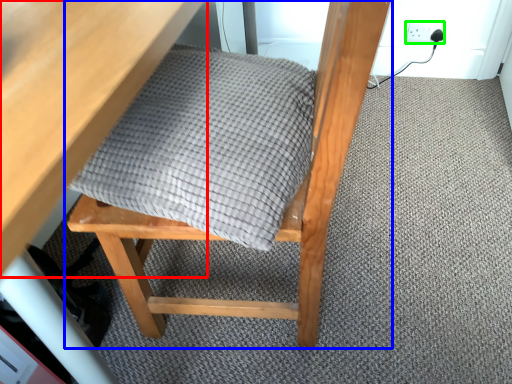
Question: Considering the real-world distances, which object is closest to table (highlighted by a red box)? chair (highlighted by a blue box) or electric outlet (highlighted by a green box).

Choices:
 (A) chair
 (B) electric outlet

Answer: (A)